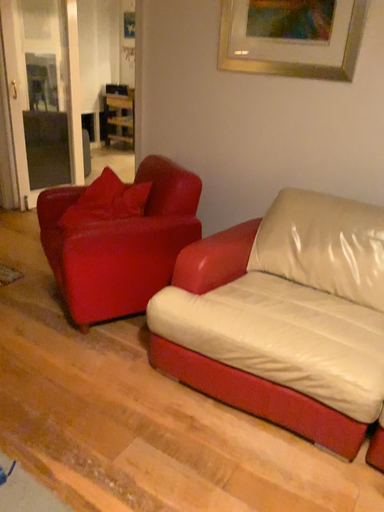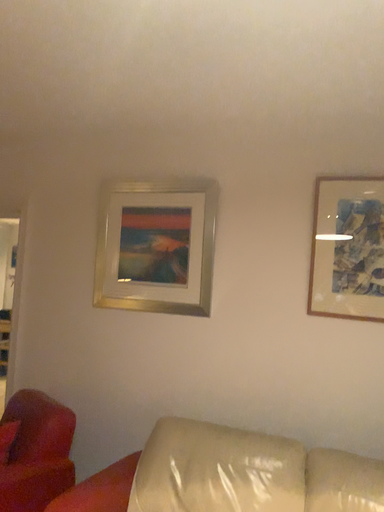
Question: Which way did the camera rotate in the video?

Choices:
 (A) rotated upward
 (B) rotated downward

Answer: (A)